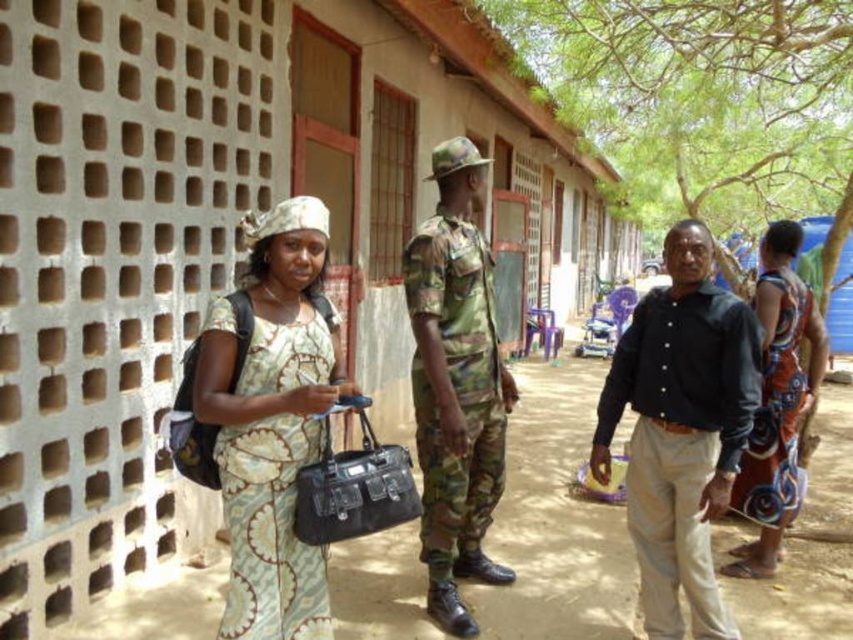
Question: Can you confirm if patterned fabric dress at center is bigger than camouflage fabric uniform at center?

Choices:
 (A) yes
 (B) no

Answer: (B)

Question: Does patterned fabric dress at center come behind printed fabric dress at right?

Choices:
 (A) no
 (B) yes

Answer: (A)

Question: Does patterned fabric dress at center have a smaller size compared to printed fabric dress at right?

Choices:
 (A) no
 (B) yes

Answer: (B)

Question: Which of the following is the farthest from the observer?

Choices:
 (A) camouflage fabric uniform at center
 (B) printed fabric dress at right
 (C) black cotton shirt at center
 (D) patterned fabric dress at center

Answer: (B)

Question: Which of the following is the farthest from the observer?

Choices:
 (A) (646, 604)
 (B) (419, 445)

Answer: (B)

Question: Which object appears closest to the camera in this image?

Choices:
 (A) printed fabric dress at right
 (B) patterned fabric dress at center
 (C) black cotton shirt at center
 (D) camouflage fabric uniform at center

Answer: (B)